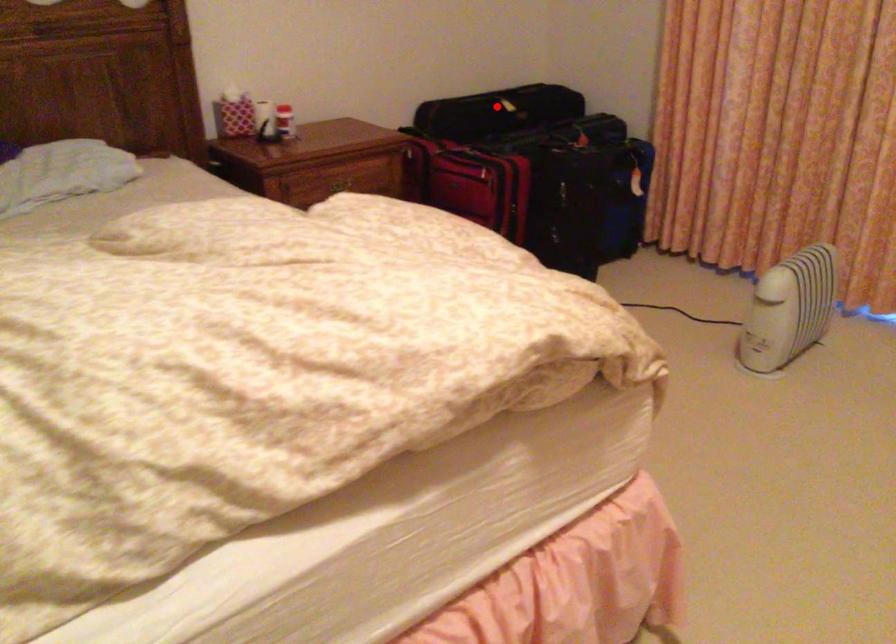
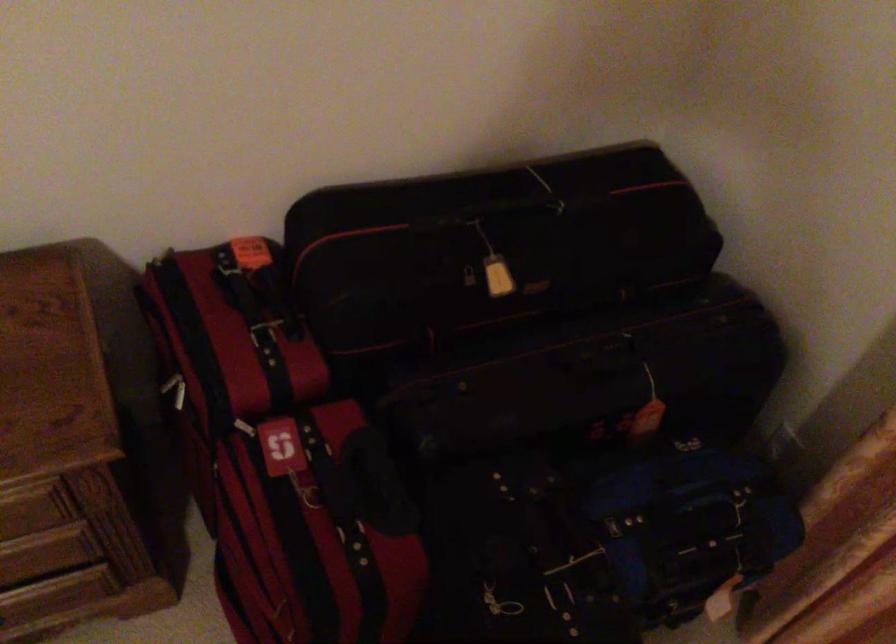
Question: I am providing you with two images of the same scene from different viewpoints. Image1 has a red point marked. In image2, the corresponding 3D location appears at what relative position? Reply with the corresponding letter.

Choices:
 (A) Closer
 (B) Farther

Answer: (A)